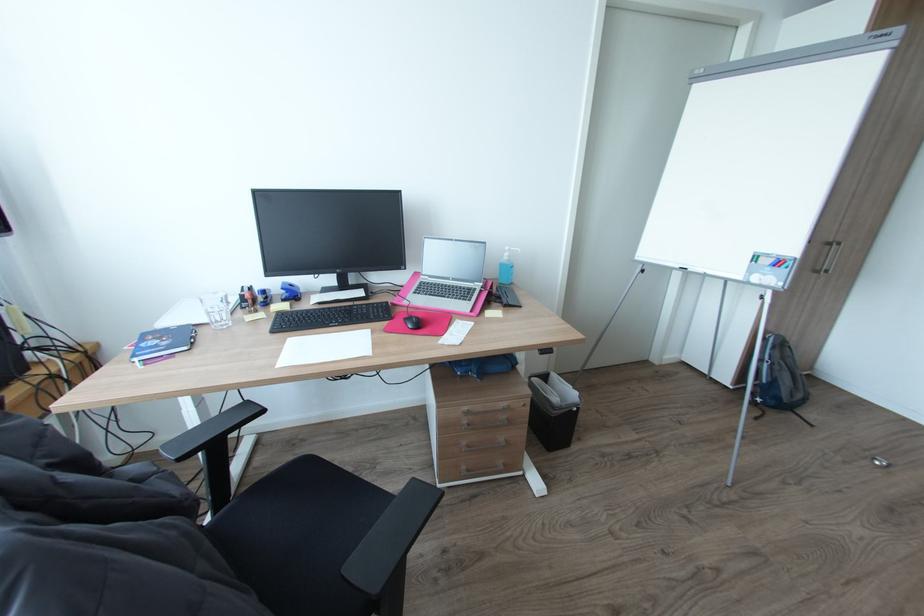
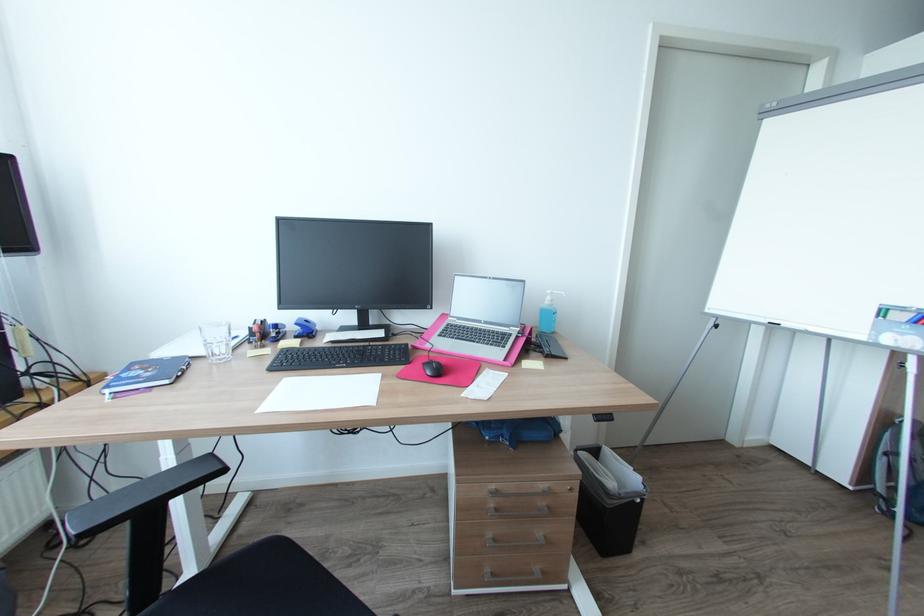
Where in the second image is the point corresponding to point (183, 456) from the first image?

(86, 531)